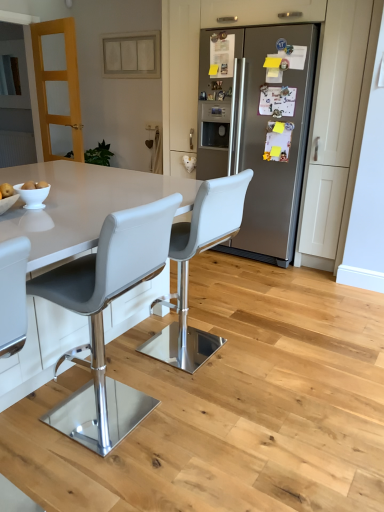
Find the location of `free space in front of white glossy bowl at lower left`. free space in front of white glossy bowl at lower left is located at coordinates (24, 223).